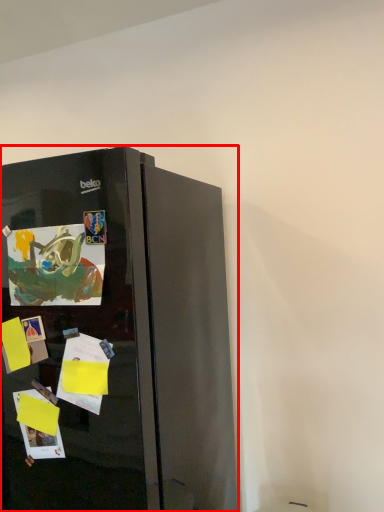
Question: From the image's perspective, where is refrigerator (annotated by the red box) located relative to postcard?

Choices:
 (A) below
 (B) above

Answer: (A)